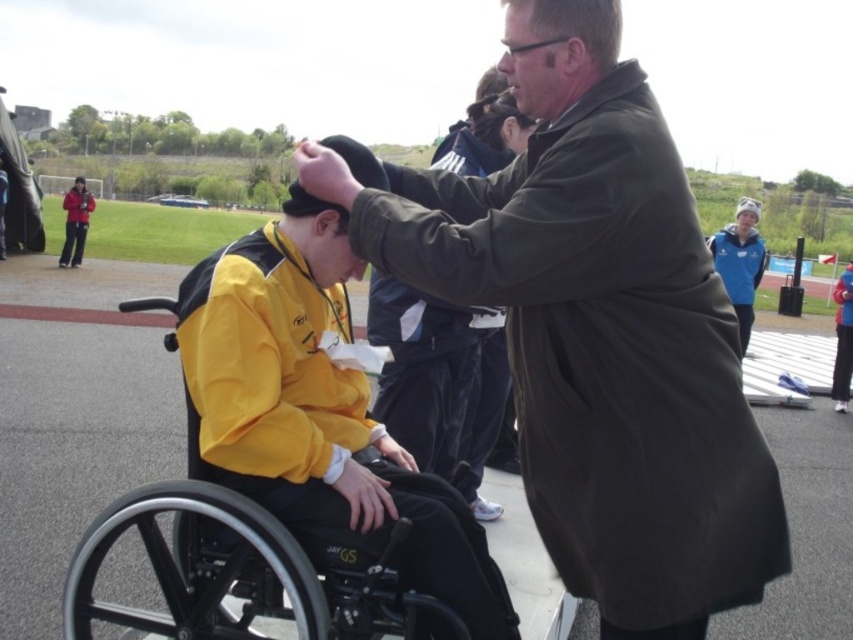
Is red fabric robe at lower right bigger than matte black jacket at left?

Indeed, red fabric robe at lower right has a larger size compared to matte black jacket at left.

Does point (839, 339) come closer to viewer compared to point (80, 253)?

Yes, it is in front of point (80, 253).

Locate an element on the screen. The height and width of the screenshot is (640, 853). red fabric robe at lower right is located at coordinates (842, 339).

Does dark green coat at center have a greater width compared to yellow matte jacket at center?

Yes.

Between point (699, 476) and point (409, 541), which one is positioned in front?

Point (699, 476)

The width and height of the screenshot is (853, 640). In order to click on dark green coat at center in this screenshot , I will do `click(596, 330)`.

Is point (479, 397) behind point (86, 225)?

No, it is in front of (86, 225).

Is dark green matte coat at upper right closer to camera compared to matte black jacket at left?

Yes, it is in front of matte black jacket at left.

Is point (410, 348) closer to viewer compared to point (77, 244)?

Yes, it is.

Locate an element on the screen. dark green matte coat at upper right is located at coordinates (433, 376).